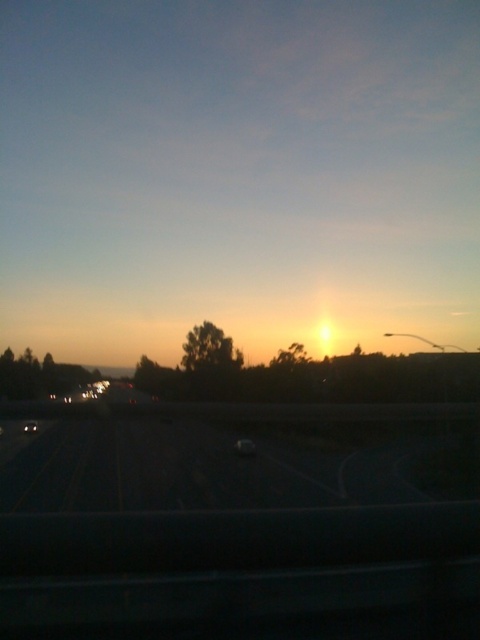
You are driving a matte white car at center and want to avoid the yellow asphalt highway at lower center. Is the highway taller than the car?

The yellow asphalt highway at lower center is much taller than the matte white car at center, so yes, the highway is taller than the car.